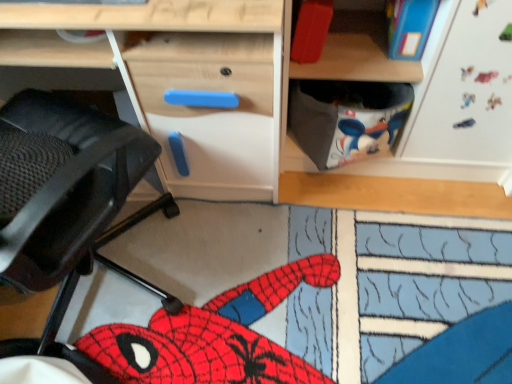
Question: Is black mesh swivel chair at left located within wooden desk at center?

Choices:
 (A) yes
 (B) no

Answer: (B)

Question: Is wooden desk at center placed right next to black mesh swivel chair at left?

Choices:
 (A) yes
 (B) no

Answer: (B)

Question: From a real-world perspective, is wooden desk at center under black mesh swivel chair at left?

Choices:
 (A) yes
 (B) no

Answer: (A)

Question: Could you tell me if wooden desk at center is facing black mesh swivel chair at left?

Choices:
 (A) no
 (B) yes

Answer: (B)

Question: Does wooden desk at center have a lesser height compared to black mesh swivel chair at left?

Choices:
 (A) yes
 (B) no

Answer: (A)

Question: Would you say wooden desk at center is a long distance from black mesh swivel chair at left?

Choices:
 (A) no
 (B) yes

Answer: (A)

Question: Could wooden desk at center be considered to be inside black mesh swivel chair at left?

Choices:
 (A) yes
 (B) no

Answer: (B)

Question: Is black mesh swivel chair at left placed right next to wooden desk at center?

Choices:
 (A) yes
 (B) no

Answer: (B)

Question: Can you confirm if black mesh swivel chair at left is wider than wooden desk at center?

Choices:
 (A) yes
 (B) no

Answer: (A)

Question: Considering the relative sizes of black mesh swivel chair at left and wooden desk at center in the image provided, is black mesh swivel chair at left thinner than wooden desk at center?

Choices:
 (A) yes
 (B) no

Answer: (B)

Question: Is black mesh swivel chair at left facing towards wooden desk at center?

Choices:
 (A) no
 (B) yes

Answer: (B)

Question: Can you confirm if black mesh swivel chair at left is shorter than wooden desk at center?

Choices:
 (A) yes
 (B) no

Answer: (B)

Question: Choose the correct answer: Is black mesh swivel chair at left inside wooden desk at center or outside it?

Choices:
 (A) inside
 (B) outside

Answer: (B)